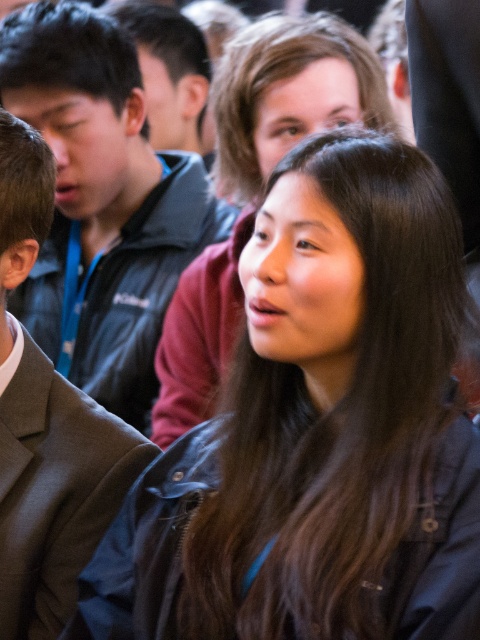
You are standing at the center of the gathering and want to reach a specific point to take a photo. The point is located at coordinates point (350, 545). Given that you need to be exactly 4 feet away from this point to capture the perfect shot, can you position yourself appropriately?

The distance of point (350, 545) from viewer is 4.09 feet, so you can move slightly closer to reduce the distance to exactly 4 feet and position yourself appropriately.

You are a photographer at an event and need to adjust your camera focus. You notice the matte black jacket at center and the dark gray suit at left. Which one is positioned higher in the frame?

The matte black jacket at center is above the dark gray suit at left, so it is positioned higher in the frame.

You are a tailor who needs to measure the distance between two jackets to ensure they fit on a display rack. The rack can only accommodate jackets that are at least 36 inches apart. Based on the image, will both the black leather jacket at center and the matte black jacket at center fit on the rack?

The black leather jacket at center and the matte black jacket at center are 37.40 inches apart, which exceeds the minimum requirement of 36 inches. Therefore, both jackets will fit on the display rack.